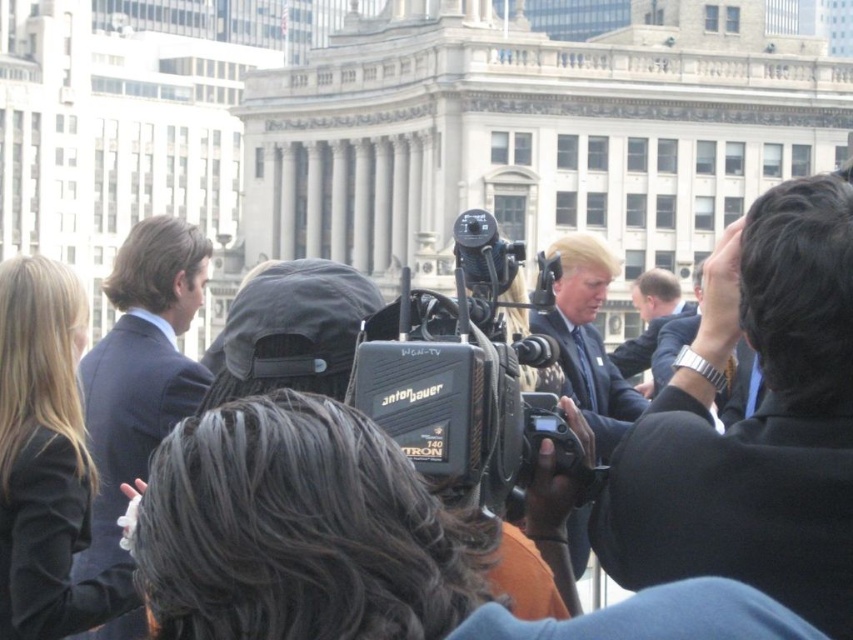
You are a photographer trying to capture a clear shot of the central figure in the scene. You notice the black suit at upper right and the silver metallic watch at upper right might obstruct your view. Which object should you adjust your angle to avoid first?

You should adjust your angle to avoid the black suit at upper right first because it is closer to the viewer than the silver metallic watch at upper right, making it the immediate obstruction.

You are a photographer at the event and need to capture a closeup of the silver metallic watch at upper right without including the black suit at upper right in the frame. Is this possible given their positions?

The black suit at upper right is to the left of the silver metallic watch at upper right, so if you position your camera to focus on the watch while angling it to exclude the area to the left, it should be possible to capture the watch without including the black suit.

Based on the scene description, which suit is wider, the dark blue suit at left or the light brown suit at center?

The dark blue suit at left is wider than the light brown suit at center according to the description.